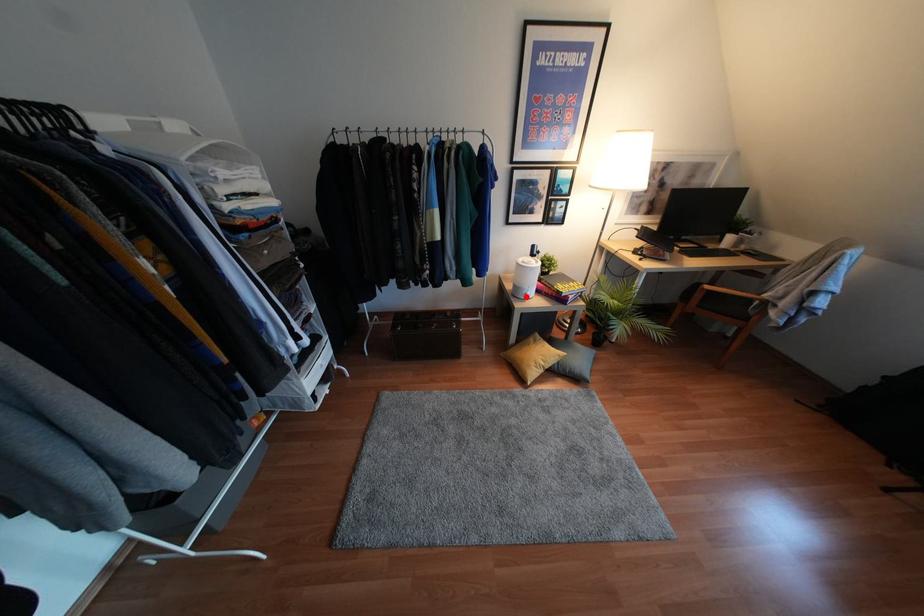
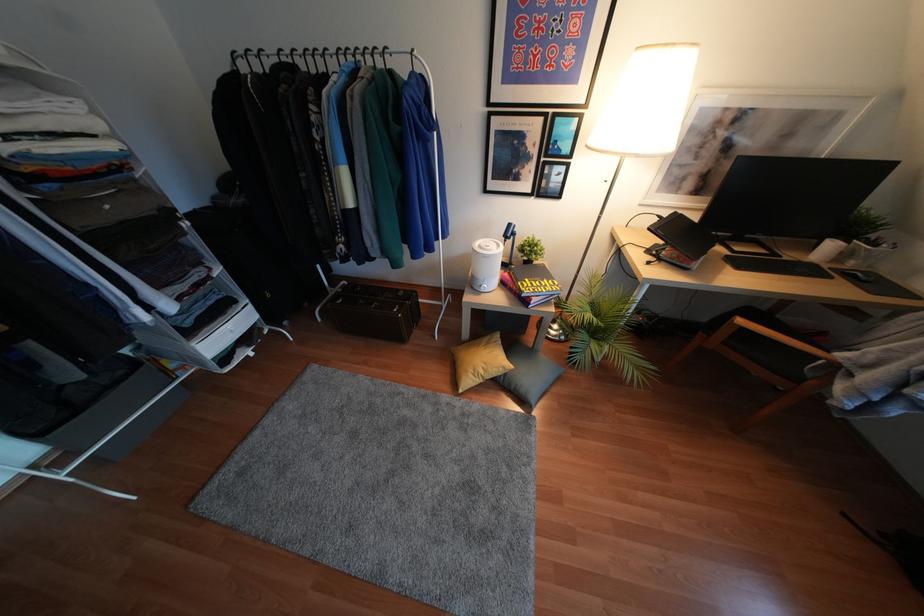
Locate, in the second image, the point that corresponds to the highlighted location in the first image.

(481, 290)